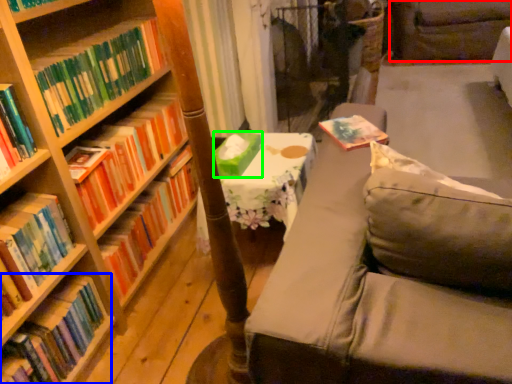
Question: Estimate the real-world distances between objects in this image. Which object is closer to swivel chair (highlighted by a red box), book (highlighted by a blue box) or paperback book (highlighted by a green box)?

Choices:
 (A) book
 (B) paperback book

Answer: (B)